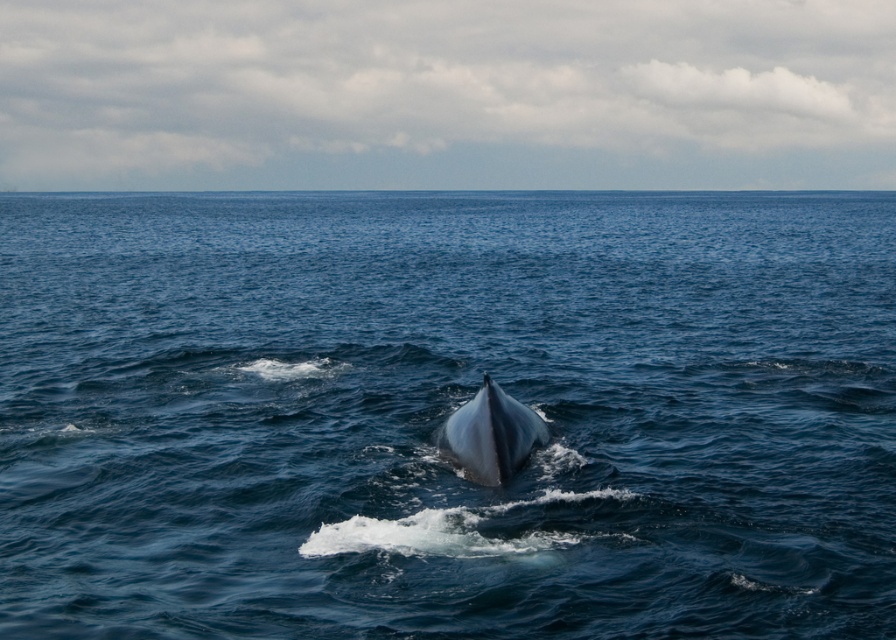
Question: Does blue water at center have a larger size compared to gray smooth whale at center?

Choices:
 (A) yes
 (B) no

Answer: (A)

Question: Observing the image, what is the correct spatial positioning of blue water at center in reference to gray smooth whale at center?

Choices:
 (A) below
 (B) above

Answer: (B)

Question: Can you confirm if blue water at center is bigger than gray smooth whale at center?

Choices:
 (A) yes
 (B) no

Answer: (A)